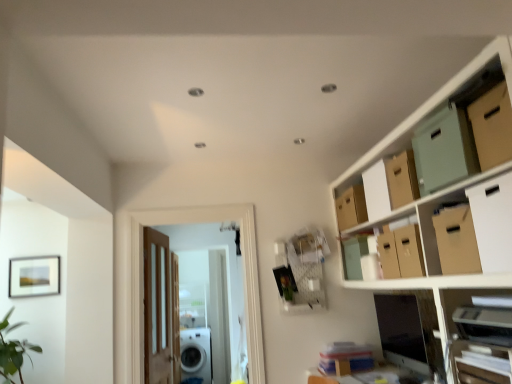
Question: Does wooden door at center, which is counted as the 2th door, starting from the back, lie in front of wooden shelf at lower right?

Choices:
 (A) no
 (B) yes

Answer: (A)

Question: Considering the relative sizes of wooden door at center, the 2th door positioned from the left, and wooden shelf at lower right in the image provided, is wooden door at center, the 2th door positioned from the left, taller than wooden shelf at lower right?

Choices:
 (A) yes
 (B) no

Answer: (A)

Question: Is wooden door at center, which is counted as the 2th door, starting from the back, thinner than wooden shelf at lower right?

Choices:
 (A) yes
 (B) no

Answer: (A)

Question: From a real-world perspective, is wooden door at center, which is the 1th door in front-to-back order, below wooden shelf at lower right?

Choices:
 (A) no
 (B) yes

Answer: (A)

Question: Can you confirm if wooden door at center, which is the 1th door in front-to-back order, is positioned to the right of wooden shelf at lower right?

Choices:
 (A) no
 (B) yes

Answer: (A)

Question: Is wooden door at center, the 2th door positioned from the left, surrounding wooden shelf at lower right?

Choices:
 (A) yes
 (B) no

Answer: (B)

Question: Is brown cardboard box at upper right, marked as the second cardboard box in a front-to-back arrangement, positioned with its back to brown cardboard box at upper right, positioned as the second cardboard box in back-to-front order?

Choices:
 (A) no
 (B) yes

Answer: (A)

Question: From the image's perspective, is brown cardboard box at upper right, the third cardboard box in the back-to-front sequence, beneath brown cardboard box at upper right, the 3th cardboard box when ordered from front to back?

Choices:
 (A) no
 (B) yes

Answer: (A)

Question: Is brown cardboard box at upper right, marked as the second cardboard box in a front-to-back arrangement, touching brown cardboard box at upper right, the 3th cardboard box when ordered from front to back?

Choices:
 (A) yes
 (B) no

Answer: (B)

Question: Is brown cardboard box at upper right, the third cardboard box in the back-to-front sequence, wider than brown cardboard box at upper right, positioned as the second cardboard box in back-to-front order?

Choices:
 (A) no
 (B) yes

Answer: (B)

Question: Could brown cardboard box at upper right, positioned as the second cardboard box in back-to-front order, be considered to be inside brown cardboard box at upper right, marked as the second cardboard box in a front-to-back arrangement?

Choices:
 (A) yes
 (B) no

Answer: (B)

Question: Does brown cardboard box at upper right, marked as the second cardboard box in a front-to-back arrangement, appear on the right side of brown cardboard box at upper right, the 3th cardboard box when ordered from front to back?

Choices:
 (A) no
 (B) yes

Answer: (B)

Question: Does white cardboard box at upper right, which appears as the first cardboard box when viewed from the front, appear on the left side of matte cardboard box at upper right, which is the 2th storage box from front to back?

Choices:
 (A) yes
 (B) no

Answer: (B)